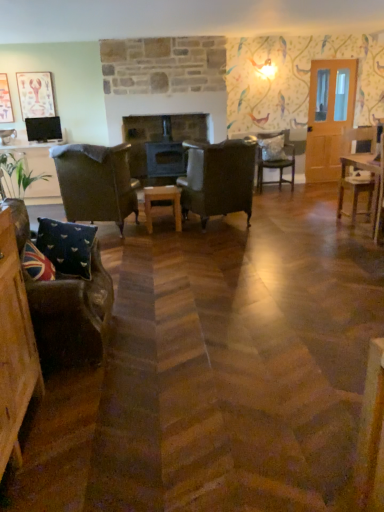
Question: Is wooden picture frame at upper left, the second picture frame from the right, positioned before velvet dark brown armchair at lower left, which is counted as the 5th chair, starting from the back?

Choices:
 (A) no
 (B) yes

Answer: (A)

Question: Is wooden picture frame at upper left, the second picture frame from the right, looking in the opposite direction of velvet dark brown armchair at lower left, which is counted as the 5th chair, starting from the back?

Choices:
 (A) no
 (B) yes

Answer: (A)

Question: Is wooden picture frame at upper left, the second picture frame from the right, positioned beyond the bounds of velvet dark brown armchair at lower left, which is the second chair from left to right?

Choices:
 (A) yes
 (B) no

Answer: (A)

Question: Does wooden picture frame at upper left, which is the first picture frame from left to right, have a larger size compared to velvet dark brown armchair at lower left, the fourth chair positioned from the right?

Choices:
 (A) no
 (B) yes

Answer: (A)

Question: Can you confirm if wooden picture frame at upper left, which is the first picture frame from left to right, is smaller than velvet dark brown armchair at lower left, which is the second chair from left to right?

Choices:
 (A) yes
 (B) no

Answer: (A)

Question: Is wooden picture frame at upper left, which is the first picture frame from left to right, to the right of velvet dark brown armchair at lower left, which is the second chair from left to right, from the viewer's perspective?

Choices:
 (A) no
 (B) yes

Answer: (A)

Question: Is union jack fabric pillow at lower left, acting as the third pillow starting from the top, to the left of velvet cushioned chair at center, which is the 1th chair in back-to-front order, from the viewer's perspective?

Choices:
 (A) yes
 (B) no

Answer: (A)

Question: Does union jack fabric pillow at lower left, acting as the third pillow starting from the top, have a smaller size compared to velvet cushioned chair at center, which is the 1th chair in back-to-front order?

Choices:
 (A) yes
 (B) no

Answer: (A)

Question: Considering the relative sizes of union jack fabric pillow at lower left, which ranks as the first pillow in left-to-right order, and velvet cushioned chair at center, marked as the 5th chair in a front-to-back arrangement, in the image provided, is union jack fabric pillow at lower left, which ranks as the first pillow in left-to-right order, shorter than velvet cushioned chair at center, marked as the 5th chair in a front-to-back arrangement,?

Choices:
 (A) no
 (B) yes

Answer: (B)

Question: Does union jack fabric pillow at lower left, which ranks as the first pillow in left-to-right order, turn towards velvet cushioned chair at center, which is the fourth chair from left to right?

Choices:
 (A) yes
 (B) no

Answer: (B)

Question: From the image's perspective, is union jack fabric pillow at lower left, marked as the 3th pillow in a back-to-front arrangement, located beneath velvet cushioned chair at center, which is the 2th chair from right to left?

Choices:
 (A) yes
 (B) no

Answer: (A)

Question: From the image's perspective, is union jack fabric pillow at lower left, marked as the 3th pillow in a back-to-front arrangement, above velvet cushioned chair at center, which is the 1th chair in back-to-front order?

Choices:
 (A) no
 (B) yes

Answer: (A)

Question: Is wooden chair at right, which is the second chair from back to front, touching wooden picture frame at upper left, which is the first picture frame from left to right?

Choices:
 (A) no
 (B) yes

Answer: (A)